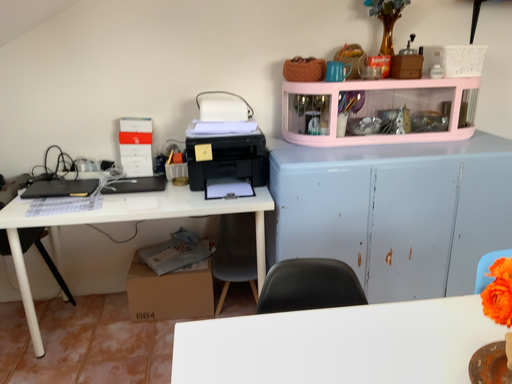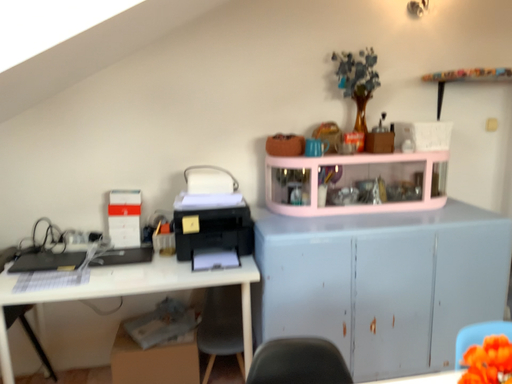
Question: Which way did the camera rotate in the video?

Choices:
 (A) rotated downward
 (B) rotated upward

Answer: (B)